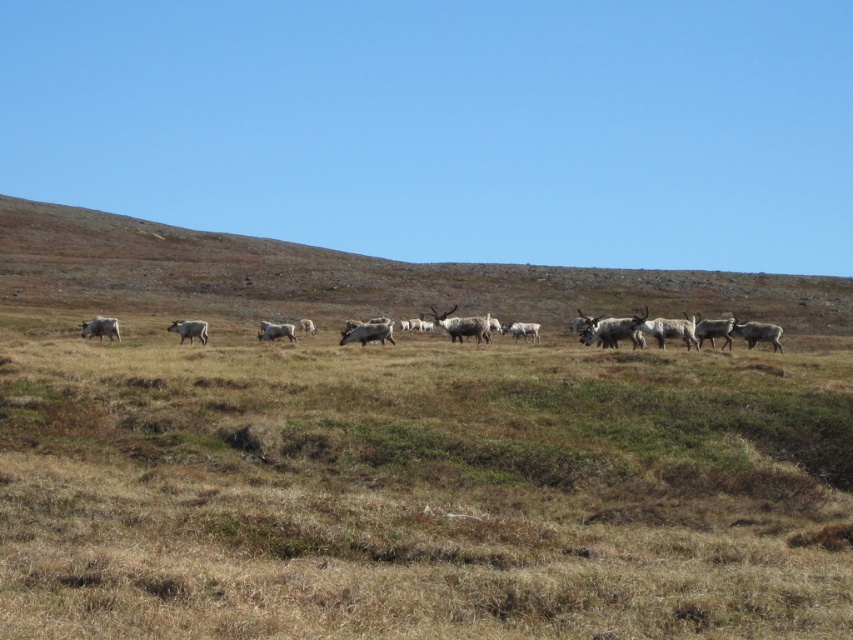
Question: Which of these objects is positioned farthest from the gray matte reindeer at center?

Choices:
 (A) brown grassland at center
 (B) brown dry grass at center

Answer: (A)

Question: Can you confirm if brown dry grass at center is positioned to the left of brown grassland at center?

Choices:
 (A) yes
 (B) no

Answer: (A)

Question: Which object appears closest to the camera in this image?

Choices:
 (A) white fur reindeer at center
 (B) brown grassland at center

Answer: (A)

Question: Does brown grassland at center have a smaller size compared to gray matte reindeer at center?

Choices:
 (A) yes
 (B) no

Answer: (B)

Question: Is brown grassland at center to the left of white fur reindeer at center from the viewer's perspective?

Choices:
 (A) yes
 (B) no

Answer: (B)

Question: Which of the following is the closest to the observer?

Choices:
 (A) gray matte reindeer at center
 (B) brown dry grass at center
 (C) brown grassland at center

Answer: (B)